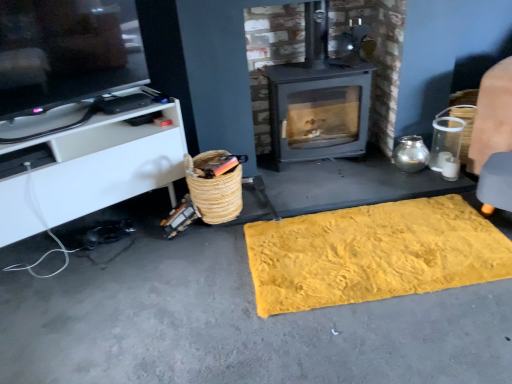
I want to click on vacant region in front of yellow textured mat at center, so click(x=406, y=339).